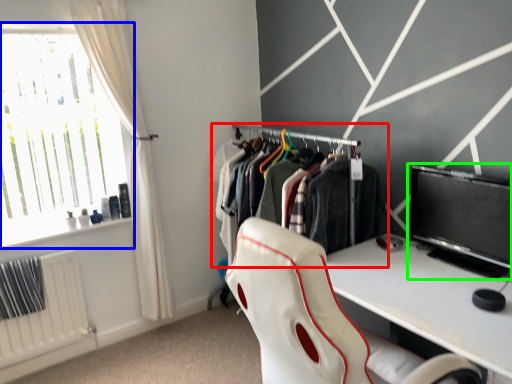
Question: Which object is positioned closest to closet (highlighted by a red box)? Select from window (highlighted by a blue box) and computer monitor (highlighted by a green box).

Choices:
 (A) window
 (B) computer monitor

Answer: (B)